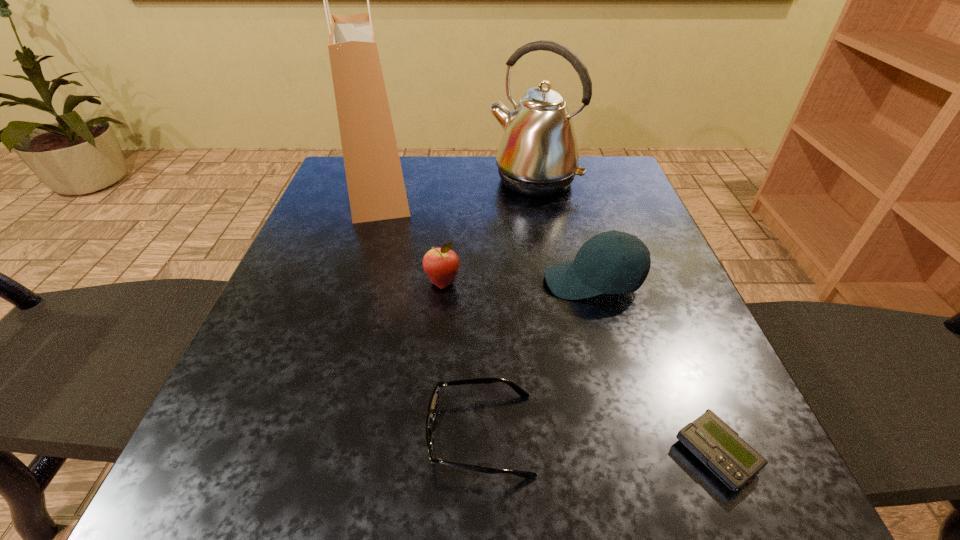
Where is `vacant space that satisfies the following two spatial constraints: 1. on the front-facing side of the baseball cap; 2. on the right side of the shortest object`? This screenshot has width=960, height=540. vacant space that satisfies the following two spatial constraints: 1. on the front-facing side of the baseball cap; 2. on the right side of the shortest object is located at coordinates (642, 455).